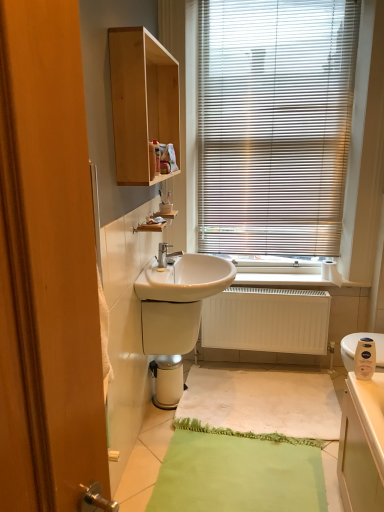
The height and width of the screenshot is (512, 384). What are the coordinates of `free location to the right of white matte toilet paper at right` in the screenshot? It's located at (348, 284).